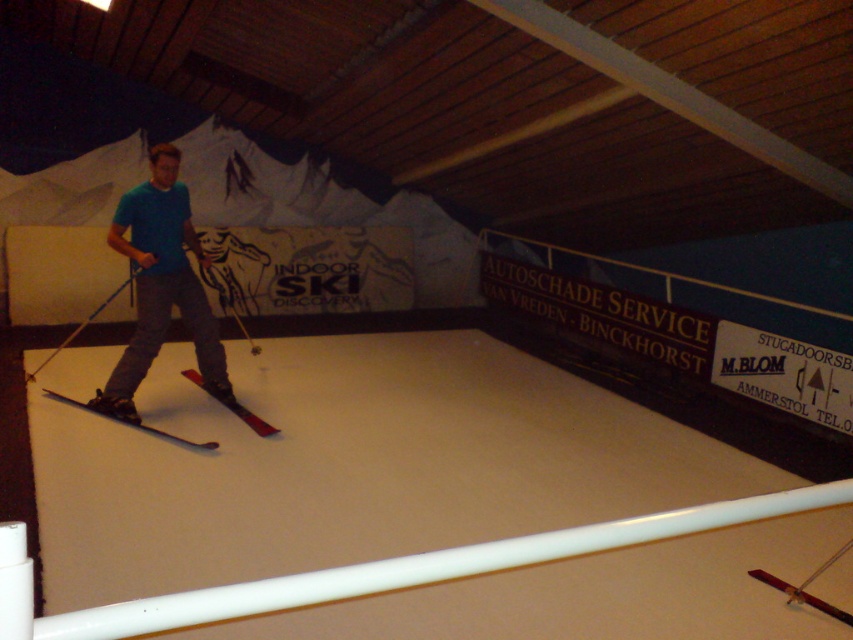
You are a visitor at the Indoor Ski Discovery facility and see both the shiny black ski at center and the red matte ski at center. Which ski is closer to you?

The shiny black ski at center is closer to you because it is in front of the red matte ski at center.

You are a maintenance worker in the indoor skiing facility. You need to ensure that the equipment is properly spaced for safety. The safety guideline requires at least 4 feet between any two pieces of equipment. Based on the image, are the shiny black ski at center and blue plastic ski pole at center meeting the safety requirement?

The distance between the shiny black ski at center and the blue plastic ski pole at center is 4.22 feet, which exceeds the required 4 feet safety guideline. Therefore, they are meeting the safety requirement.

You are a visitor at the indoor skiing facility and want to know which object is shorter between the shiny black ski at center and the blue plastic ski pole at center. Can you tell me?

The shiny black ski at center is shorter than the blue plastic ski pole at center.